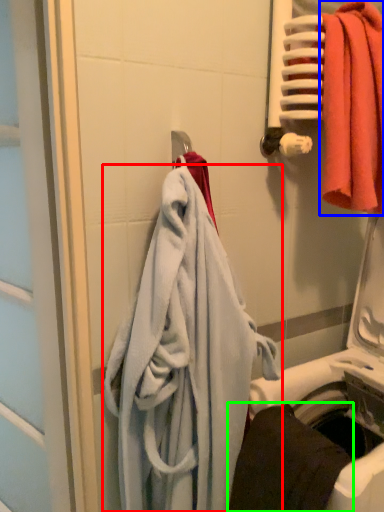
Question: Which object is the farthest from towel (highlighted by a red box)? Choose among these: towel (highlighted by a blue box) or towel (highlighted by a green box).

Choices:
 (A) towel
 (B) towel

Answer: (A)